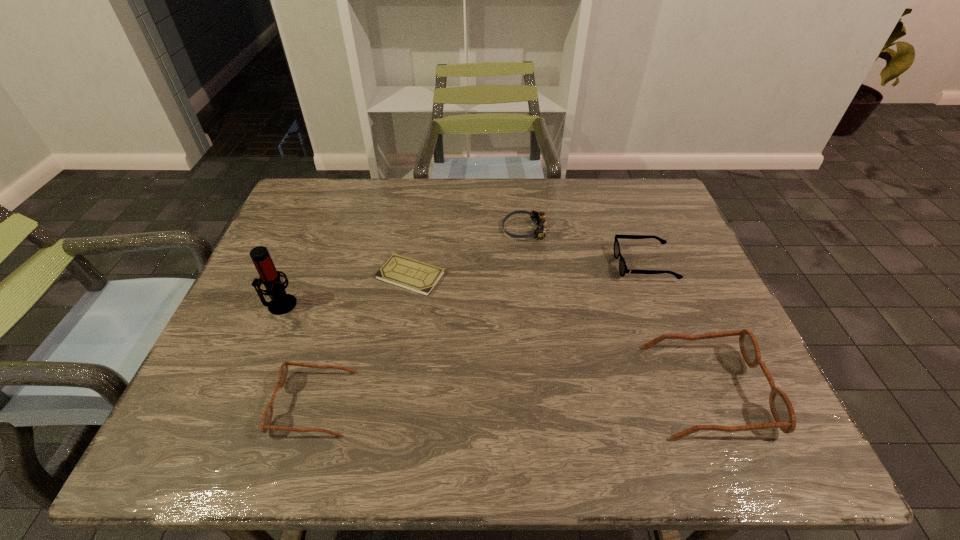
The image size is (960, 540). What are the coordinates of `vacant space that satisfies the following two spatial constraints: 1. on the back side of the checkbook; 2. on the left side of the leftmost object` in the screenshot? It's located at (292, 275).

At what (x,y) coordinates should I click in order to perform the action: click on blank area in the image that satisfies the following two spatial constraints: 1. through the lenses of the goggles; 2. on the front side of the shortest object. Please return your answer as a coordinate pair (x, y). Image resolution: width=960 pixels, height=540 pixels. Looking at the image, I should click on (531, 275).